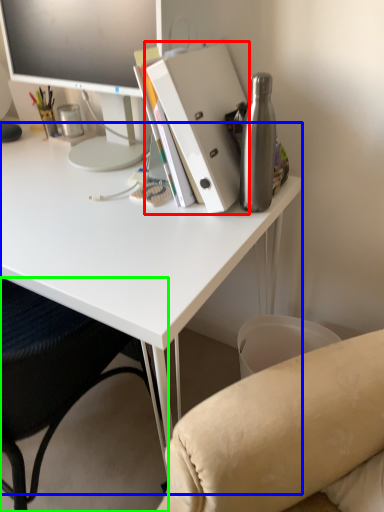
Question: Based on their relative distances, which object is farther from paperback book (highlighted by a red box)? Choose from desk (highlighted by a blue box) and chair (highlighted by a green box).

Choices:
 (A) desk
 (B) chair

Answer: (B)